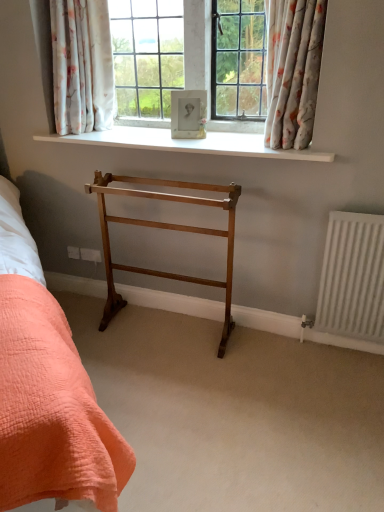
Question: Considering the relative positions of porcelain frame at center and floral fabric curtain at upper right, positioned as the 2th curtain in left-to-right order, in the image provided, is porcelain frame at center to the right of floral fabric curtain at upper right, positioned as the 2th curtain in left-to-right order, from the viewer's perspective?

Choices:
 (A) yes
 (B) no

Answer: (B)

Question: From a real-world perspective, is porcelain frame at center located beneath floral fabric curtain at upper right, which is the 1th curtain from right to left?

Choices:
 (A) no
 (B) yes

Answer: (B)

Question: Is porcelain frame at center next to floral fabric curtain at upper right, positioned as the 2th curtain in left-to-right order?

Choices:
 (A) no
 (B) yes

Answer: (A)

Question: Is porcelain frame at center looking in the opposite direction of floral fabric curtain at upper right, which is the 1th curtain from right to left?

Choices:
 (A) yes
 (B) no

Answer: (B)

Question: Can we say porcelain frame at center lies outside floral fabric curtain at upper right, positioned as the 2th curtain in left-to-right order?

Choices:
 (A) no
 (B) yes

Answer: (B)

Question: From their relative heights in the image, would you say floral fabric curtain at upper right, which is the 1th curtain from right to left, is taller or shorter than light brown wood towel rack at center?

Choices:
 (A) short
 (B) tall

Answer: (A)

Question: Considering the positions of floral fabric curtain at upper right, positioned as the 2th curtain in left-to-right order, and light brown wood towel rack at center in the image, is floral fabric curtain at upper right, positioned as the 2th curtain in left-to-right order, bigger or smaller than light brown wood towel rack at center?

Choices:
 (A) small
 (B) big

Answer: (A)

Question: From the image's perspective, is floral fabric curtain at upper right, which is the 1th curtain from right to left, positioned above or below light brown wood towel rack at center?

Choices:
 (A) above
 (B) below

Answer: (A)

Question: In the image, is floral fabric curtain at upper right, positioned as the 2th curtain in left-to-right order, positioned in front of or behind light brown wood towel rack at center?

Choices:
 (A) behind
 (B) front

Answer: (B)

Question: Considering the positions of white matte radiator at right and light brown wood towel rack at center in the image, is white matte radiator at right taller or shorter than light brown wood towel rack at center?

Choices:
 (A) tall
 (B) short

Answer: (B)

Question: From the image's perspective, relative to light brown wood towel rack at center, is white matte radiator at right above or below?

Choices:
 (A) above
 (B) below

Answer: (B)

Question: From a real-world perspective, relative to light brown wood towel rack at center, is white matte radiator at right vertically above or below?

Choices:
 (A) above
 (B) below

Answer: (B)

Question: Is white matte radiator at right in front of or behind light brown wood towel rack at center in the image?

Choices:
 (A) front
 (B) behind

Answer: (B)

Question: Considering their positions, is floral fabric curtain at upper center, marked as the 1th curtain in a left-to-right arrangement, located in front of or behind white smooth window sill at upper center?

Choices:
 (A) front
 (B) behind

Answer: (B)

Question: In terms of height, does floral fabric curtain at upper center, positioned as the 2th curtain in right-to-left order, look taller or shorter compared to white smooth window sill at upper center?

Choices:
 (A) short
 (B) tall

Answer: (B)